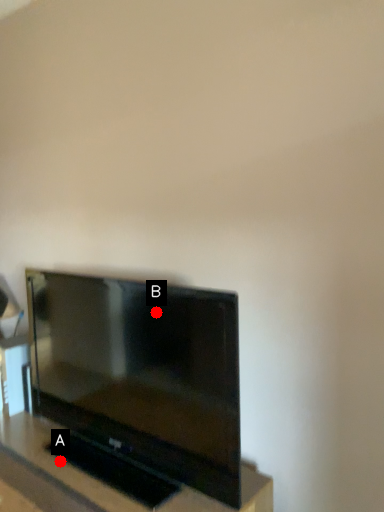
Question: Two points are circled on the image, labeled by A and B beside each circle. Which of the following is the closest to the observer?

Choices:
 (A) A is closer
 (B) B is closer

Answer: (B)